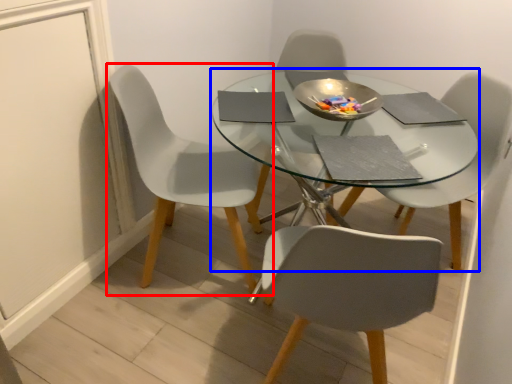
Question: Which object is closer to the camera taking this photo, chair (highlighted by a red box) or round table (highlighted by a blue box)?

Choices:
 (A) chair
 (B) round table

Answer: (B)